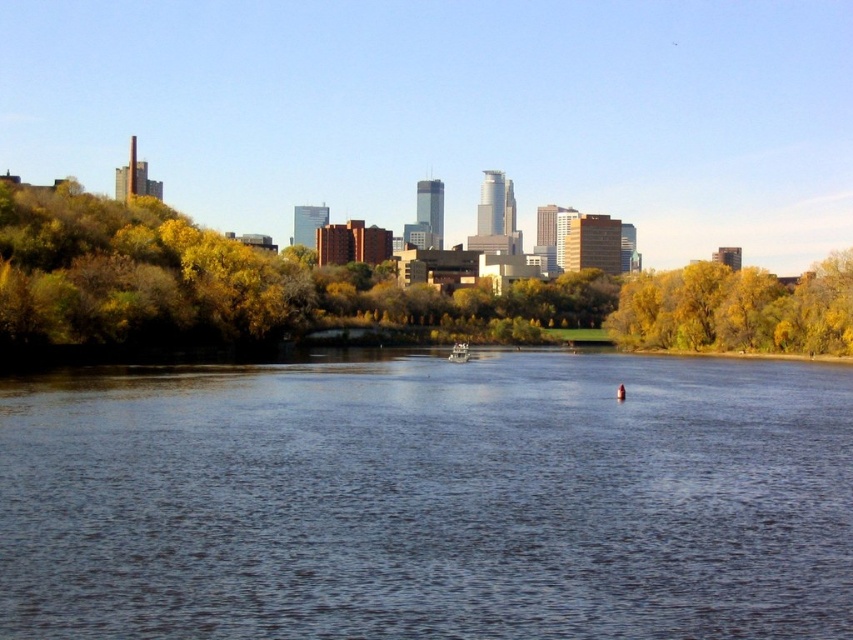
Question: Which of the following is the farthest from the observer?

Choices:
 (A) (471, 369)
 (B) (451, 344)
 (C) (190, 300)

Answer: (B)

Question: Which point is farther to the camera?

Choices:
 (A) (462, 356)
 (B) (608, 396)

Answer: (A)

Question: Does blue water at center have a lesser width compared to wooden boat at center?

Choices:
 (A) no
 (B) yes

Answer: (A)

Question: Observing the image, what is the correct spatial positioning of yellow-green foliage at center in reference to wooden boat at center?

Choices:
 (A) left
 (B) right

Answer: (B)

Question: Which of the following is the farthest from the observer?

Choices:
 (A) blue water at center
 (B) yellow-green foliage at center
 (C) wooden boat at center

Answer: (C)

Question: Is blue water at center closer to the viewer compared to wooden boat at center?

Choices:
 (A) yes
 (B) no

Answer: (A)